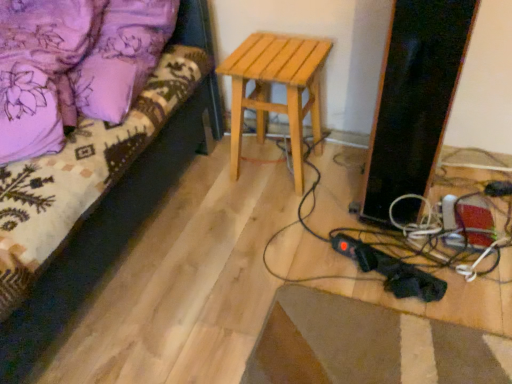
This screenshot has height=384, width=512. In order to click on vacant area situated below light brown wooden stool at center (from a real-world perspective) in this screenshot , I will do `click(272, 163)`.